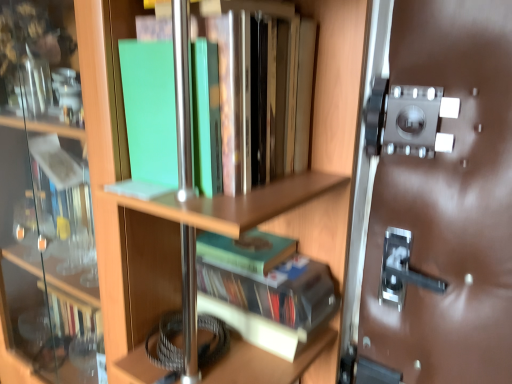
Question: Is green matte book at center, which is the 1th book from bottom to top, wider or thinner than green matte book at upper left, the 3th book positioned from the bottom?

Choices:
 (A) wide
 (B) thin

Answer: (B)

Question: Is green matte book at center, which is the third book in top-to-bottom order, in front of or behind green matte book at upper left, the 3th book positioned from the bottom, in the image?

Choices:
 (A) behind
 (B) front

Answer: (A)

Question: Which object is the farthest from the green matte book at center, acting as the 2th book starting from the top?

Choices:
 (A) green matte book at center, which is the 1th book from bottom to top
 (B) green matte book at upper left, the 3th book positioned from the bottom

Answer: (B)

Question: Which object is positioned closest to the green matte book at center, which is the third book in top-to-bottom order?

Choices:
 (A) green matte book at upper left, which appears as the 1th book when viewed from the top
 (B) green matte book at center, the second book positioned from the bottom

Answer: (B)